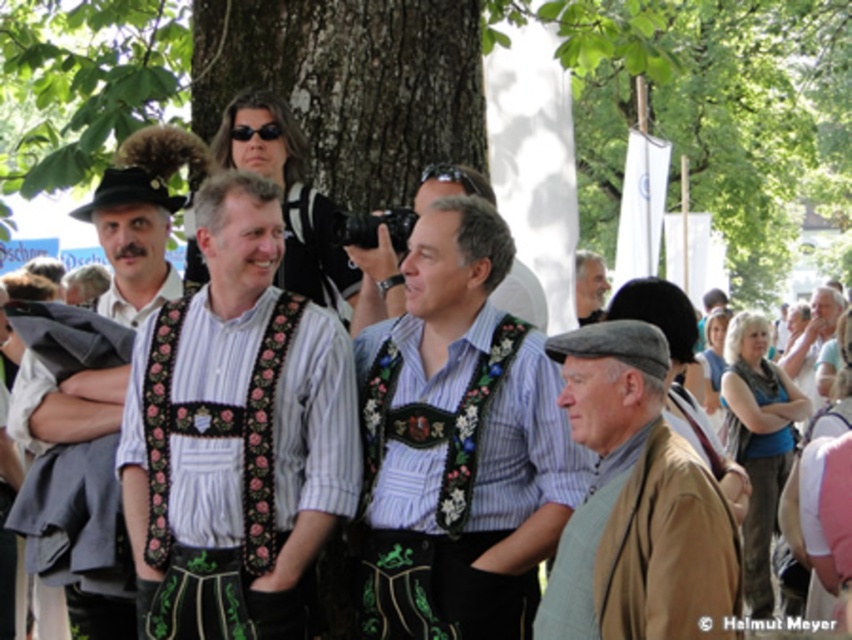
Question: Does brown woolen hat at lower right have a lesser width compared to matte black vest at left?

Choices:
 (A) yes
 (B) no

Answer: (A)

Question: Which of the following is the closest to the observer?

Choices:
 (A) gray woolen hat at upper right
 (B) embroidered fabric shirt at center
 (C) light blue shirt at right

Answer: (B)

Question: Does light blue shirt at right have a greater width compared to gray woolen hat at upper right?

Choices:
 (A) no
 (B) yes

Answer: (B)

Question: Which point is closer to the camera?

Choices:
 (A) embroidered fabric vest at center
 (B) matte black vest at left
 (C) gray woolen hat at upper right

Answer: (A)

Question: Does embroidered fabric vest at center have a lesser width compared to brown woolen hat at lower right?

Choices:
 (A) no
 (B) yes

Answer: (A)

Question: Considering the real-world distances, which object is farthest from the gray woolen hat at upper right?

Choices:
 (A) matte black vest at left
 (B) brown woolen hat at lower right
 (C) light blue shirt at right

Answer: (A)